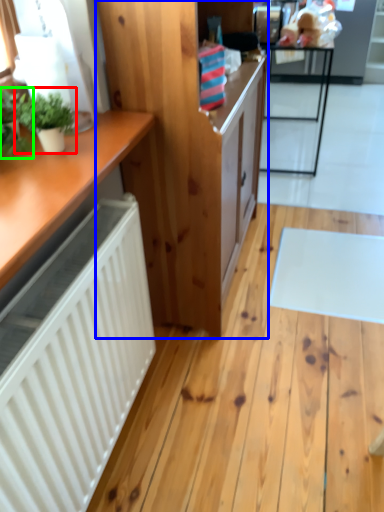
Question: Based on their relative distances, which object is farther from houseplant (highlighted by a red box)? Choose from cabinetry (highlighted by a blue box) and houseplant (highlighted by a green box).

Choices:
 (A) cabinetry
 (B) houseplant

Answer: (A)